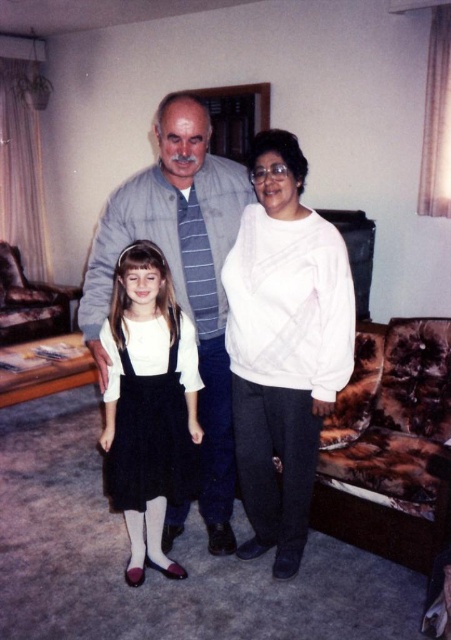
Question: Does white soft sweater at center lie in front of white matte dress at center?

Choices:
 (A) no
 (B) yes

Answer: (B)

Question: Which of the following is the closest to the observer?

Choices:
 (A) white matte dress at center
 (B) fur-like fabric couch at lower right
 (C) gray striped shirt at center

Answer: (C)

Question: Does white soft sweater at center appear under brown fur couch at left?

Choices:
 (A) yes
 (B) no

Answer: (A)

Question: Which point appears closest to the camera in this image?

Choices:
 (A) click(x=211, y=461)
 (B) click(x=265, y=237)
 (C) click(x=0, y=337)
 (D) click(x=383, y=394)

Answer: (B)

Question: Considering the real-world distances, which object is closest to the gray striped shirt at center?

Choices:
 (A) white soft sweater at center
 (B) white matte dress at center

Answer: (B)

Question: Does gray striped shirt at center appear over fur-like fabric couch at lower right?

Choices:
 (A) no
 (B) yes

Answer: (B)